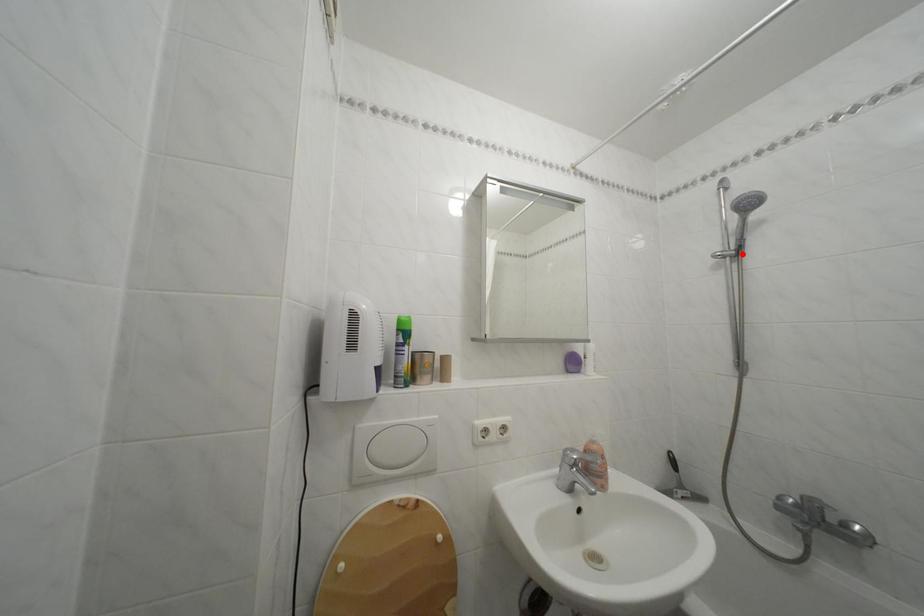
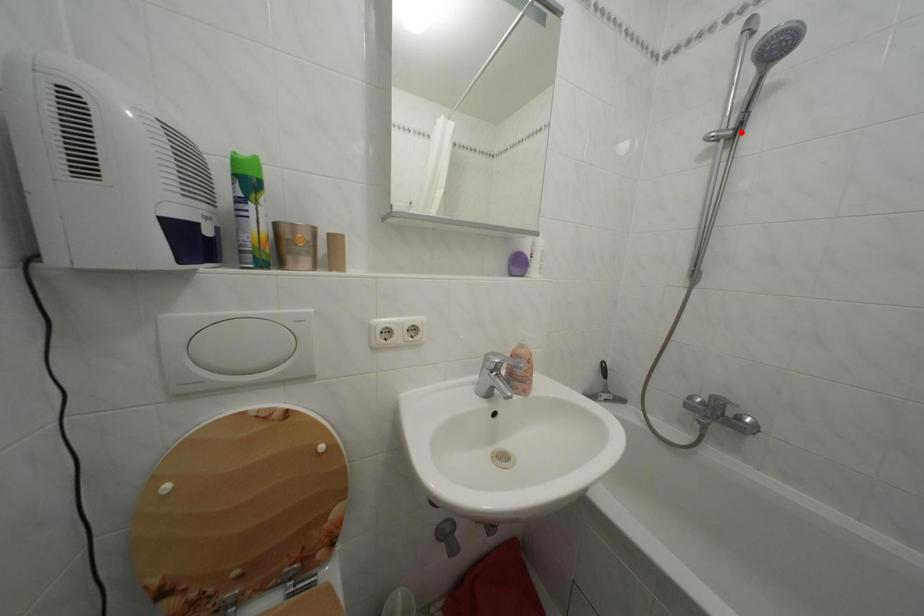
I am providing you with two images of the same scene from different viewpoints. A red point is marked on the first image and another point is marked on the second image. Are the points marked in image1 and image2 representing the same 3D position?

Yes